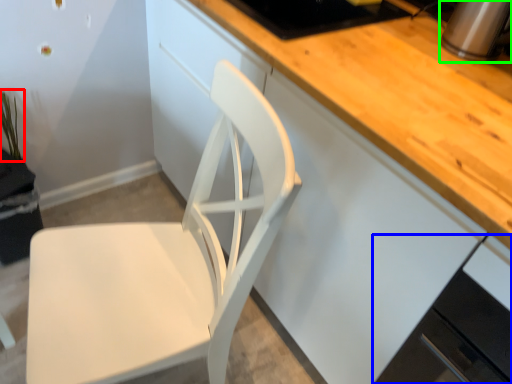
Question: Which is farther away from plant (highlighted by a red box)? cabinetry (highlighted by a blue box) or appliance (highlighted by a green box)?

Choices:
 (A) cabinetry
 (B) appliance

Answer: (A)